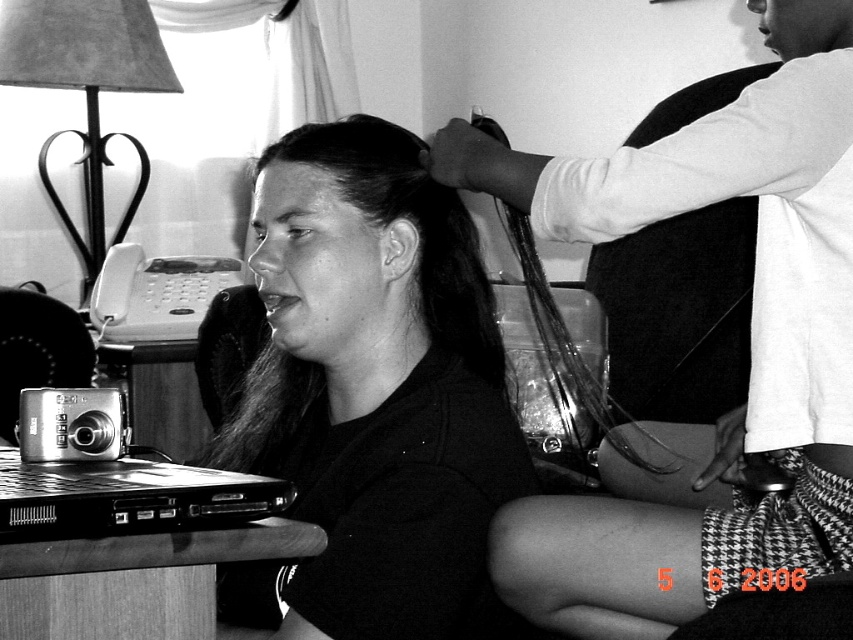
Question: Does smooth dark hair at center come in front of smooth white arm at upper right?

Choices:
 (A) no
 (B) yes

Answer: (B)

Question: Can you confirm if smooth dark hair at center is positioned to the right of smooth white arm at upper right?

Choices:
 (A) yes
 (B) no

Answer: (B)

Question: Can you confirm if smooth dark hair at center is wider than black plastic laptop at lower left?

Choices:
 (A) no
 (B) yes

Answer: (A)

Question: Considering the real-world distances, which object is farthest from the black plastic laptop at lower left?

Choices:
 (A) smooth dark hair at center
 (B) smooth white arm at upper right

Answer: (B)

Question: Which point is farther to the camera?

Choices:
 (A) (456, 128)
 (B) (120, 528)
 (C) (310, 412)

Answer: (C)

Question: Considering the real-world distances, which object is closest to the smooth dark hair at center?

Choices:
 (A) smooth white arm at upper right
 (B) black plastic laptop at lower left

Answer: (A)